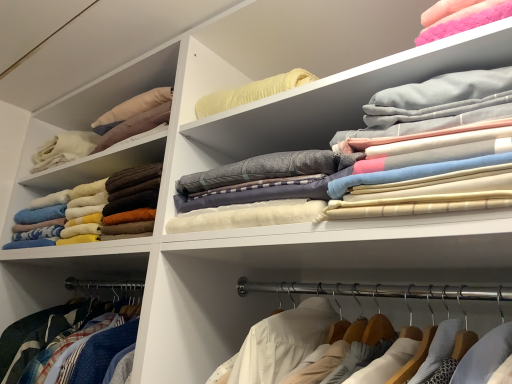
Question: Considering the relative sizes of soft cotton sheets at upper right, which ranks as the second clothing in left-to-right order, and fluffy brown blanket at left, which ranks as the 1th clothing in left-to-right order, in the image provided, is soft cotton sheets at upper right, which ranks as the second clothing in left-to-right order, smaller than fluffy brown blanket at left, which ranks as the 1th clothing in left-to-right order,?

Choices:
 (A) yes
 (B) no

Answer: (A)

Question: Is soft cotton sheets at upper right, the 2th clothing viewed from the back, to the left of fluffy brown blanket at left, the 1th clothing viewed from the back, from the viewer's perspective?

Choices:
 (A) no
 (B) yes

Answer: (A)

Question: Is soft cotton sheets at upper right, the 2th clothing viewed from the back, behind fluffy brown blanket at left, the 1th clothing viewed from the back?

Choices:
 (A) yes
 (B) no

Answer: (B)

Question: Is soft cotton sheets at upper right, the first clothing in the right-to-left sequence, aimed at fluffy brown blanket at left, the 1th clothing viewed from the back?

Choices:
 (A) no
 (B) yes

Answer: (A)

Question: From the image's perspective, is soft cotton sheets at upper right, the 2th clothing viewed from the back, on fluffy brown blanket at left, the 2th clothing positioned from the right?

Choices:
 (A) no
 (B) yes

Answer: (B)

Question: Are soft cotton sheets at upper right, the first clothing in the right-to-left sequence, and fluffy brown blanket at left, the 1th clothing viewed from the back, beside each other?

Choices:
 (A) no
 (B) yes

Answer: (A)

Question: Considering the relative sizes of fluffy brown blanket at left, the 2th clothing positioned from the right, and soft cotton sheets at upper right, the 2th clothing viewed from the back, in the image provided, is fluffy brown blanket at left, the 2th clothing positioned from the right, wider than soft cotton sheets at upper right, the 2th clothing viewed from the back,?

Choices:
 (A) yes
 (B) no

Answer: (A)

Question: Does fluffy brown blanket at left, the 2th clothing in the front-to-back sequence, have a greater height compared to soft cotton sheets at upper right, the first clothing in the right-to-left sequence?

Choices:
 (A) yes
 (B) no

Answer: (B)

Question: From the image's perspective, is fluffy brown blanket at left, which ranks as the 1th clothing in left-to-right order, over soft cotton sheets at upper right, which ranks as the second clothing in left-to-right order?

Choices:
 (A) yes
 (B) no

Answer: (B)

Question: From a real-world perspective, is fluffy brown blanket at left, the 1th clothing viewed from the back, physically below soft cotton sheets at upper right, which ranks as the second clothing in left-to-right order?

Choices:
 (A) yes
 (B) no

Answer: (A)

Question: Is fluffy brown blanket at left, the 2th clothing in the front-to-back sequence, to the left of soft cotton sheets at upper right, the first clothing in the right-to-left sequence, from the viewer's perspective?

Choices:
 (A) yes
 (B) no

Answer: (A)

Question: Considering the relative sizes of fluffy brown blanket at left, the 1th clothing viewed from the back, and soft cotton sheets at upper right, which is the first clothing in front-to-back order, in the image provided, is fluffy brown blanket at left, the 1th clothing viewed from the back, shorter than soft cotton sheets at upper right, which is the first clothing in front-to-back order,?

Choices:
 (A) yes
 (B) no

Answer: (A)

Question: Is fluffy brown blanket at left, the 1th clothing viewed from the back, taller or shorter than soft cotton sheets at upper right, the 2th clothing viewed from the back?

Choices:
 (A) short
 (B) tall

Answer: (A)